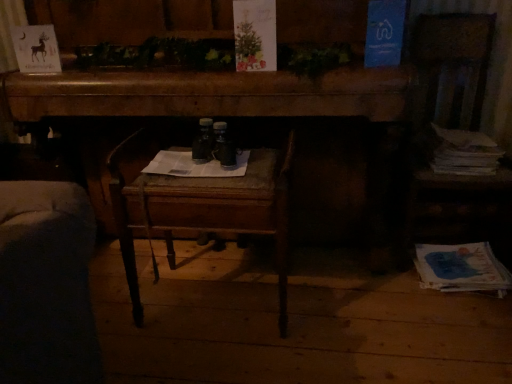
Identify the location of vacant point to the right of wooden chair at center. (336, 306).